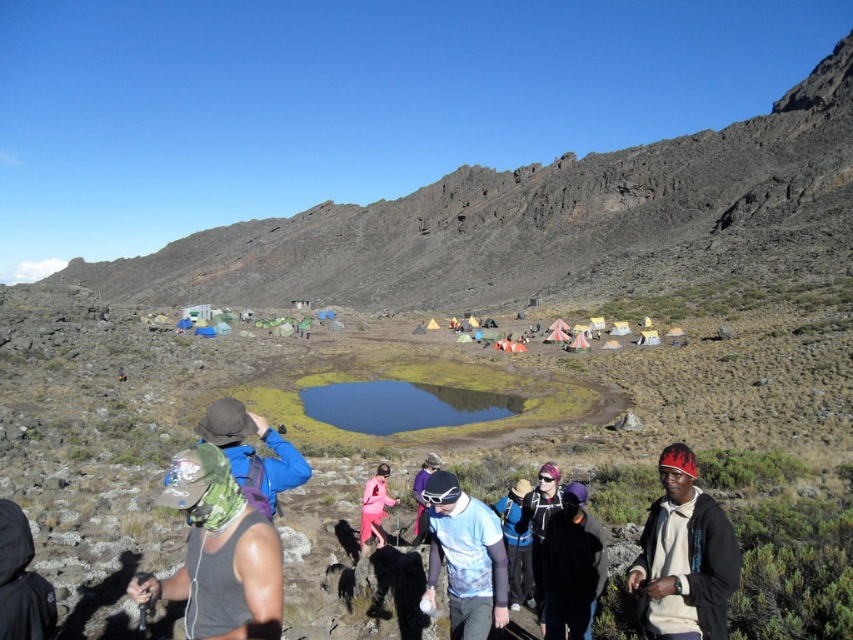
You are a hiker planning to set up a tent near the point marked at coordinates point (292, 461) and point (527, 605). Which point is closer to your current position if you are standing at the camera position?

Point (292, 461) is closer to the camera than point (527, 605), so you should set up your tent near point (292, 461) as it is closer to your current position.

You are a hiker trying to reach the cluster of colorful tents beyond the pond. You see the rugged rock mountain at center and the blue fabric jacket at center. Which object is closer to you as you move forward?

The blue fabric jacket at center is closer to you than the rugged rock mountain at center, so you will encounter the blue fabric jacket at center first on your path to the tents.

You are a hiker trying to locate your friend who is wearing a blue fabric jacket at center. You see a camouflage fabric hat at center nearby. Which item is closer to you?

The camouflage fabric hat at center is closer to the viewer than the blue fabric jacket at center, so the hat is closer to you.